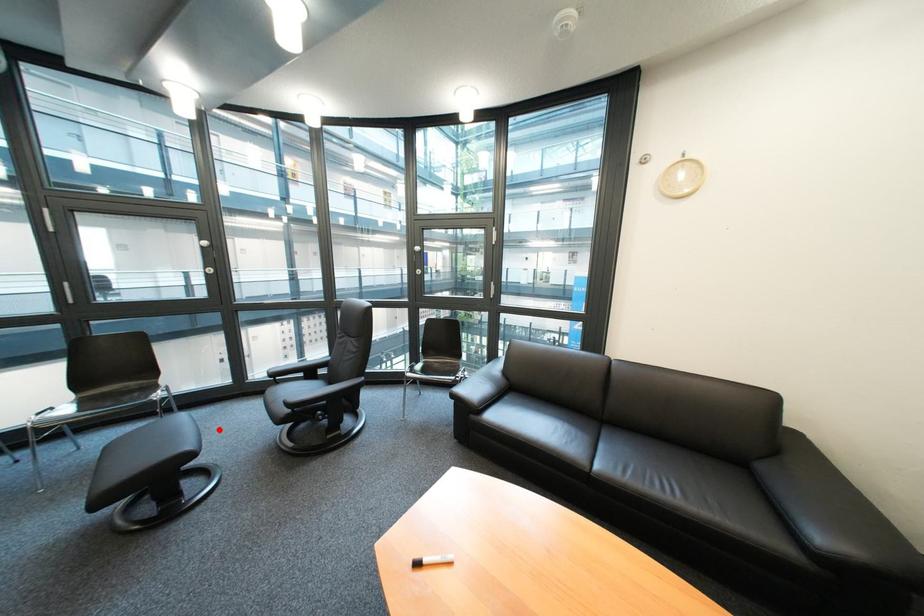
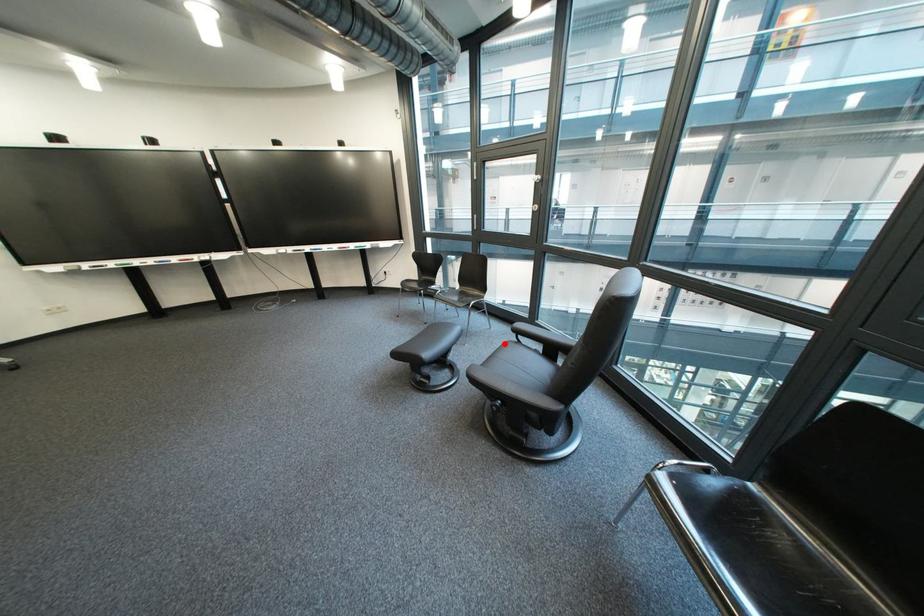
Consider the image. I am providing you with two images of the same scene from different viewpoints. A red point is marked on the first image and another point is marked on the second image. Is the red point in image1 aligned with the point shown in image2?

Yes